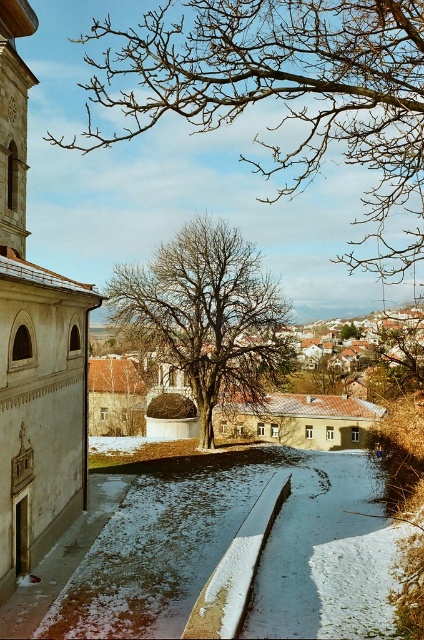
You are a bird looking for a place to perch. You see two sets of branches in the tree in the center of the image. Which set of branches, the bare branches at upper center or the bare branches at center, is positioned higher up in the tree?

The bare branches at upper center is positioned higher up in the tree than the bare branches at center.

You are standing at the point marked as point (282, 93) in the winter scene. What do you see directly in front of you?

You see the bare branches at upper center directly in front of you, as point (282, 93) corresponds to that location.